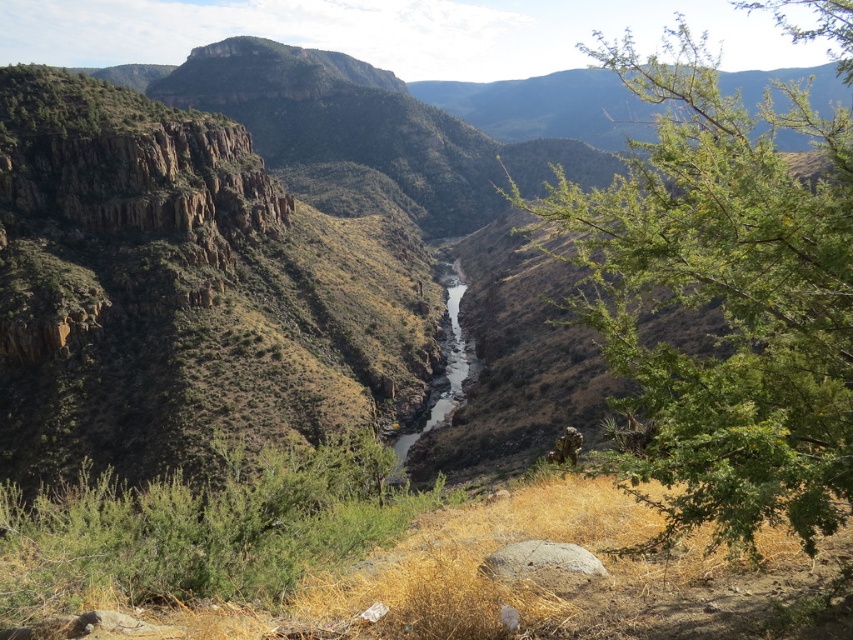
Between green leafy tree at lower right and white sandy stream at center, which one has more height?

Standing taller between the two is green leafy tree at lower right.

Is point (759, 401) closer to camera compared to point (409, 435)?

Yes, it is in front of point (409, 435).

You are a GUI agent. You are given a task and a screenshot of the screen. Output one action in this format:
    pyautogui.click(x=<x>, y=<y>)
    Task: Click on the green leafy tree at lower right
    
    Given the screenshot: What is the action you would take?
    pyautogui.click(x=726, y=298)